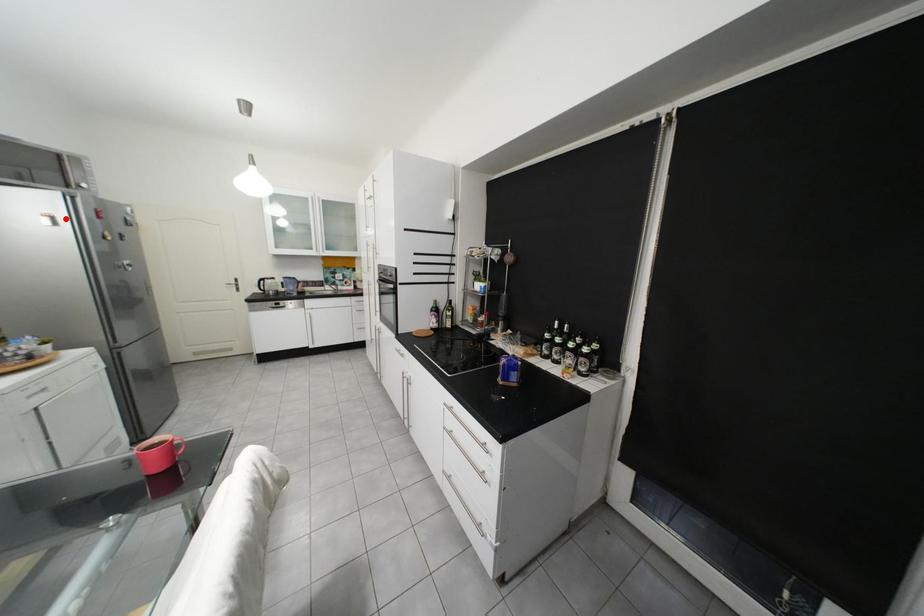
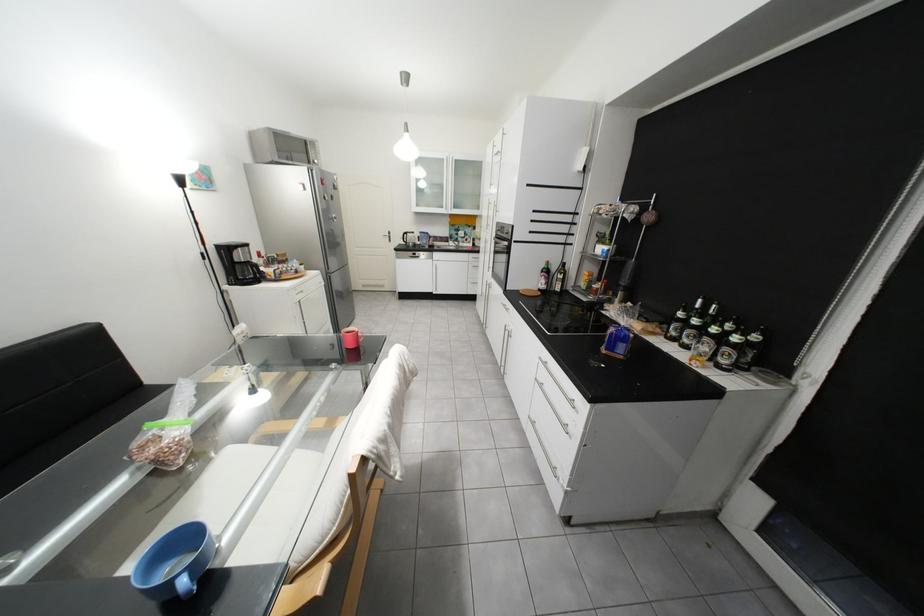
In the second image, find the point that corresponds to the highlighted location in the first image.

(315, 185)